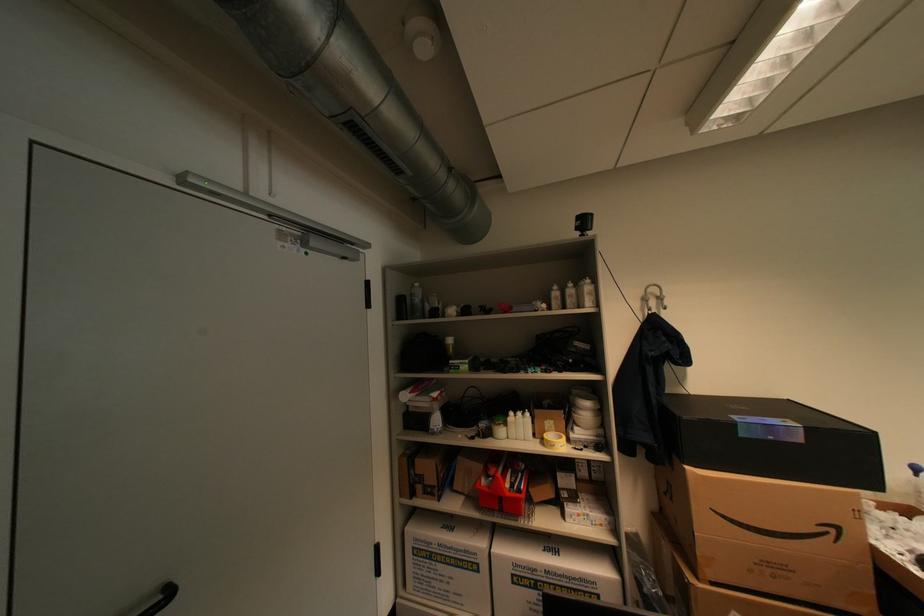
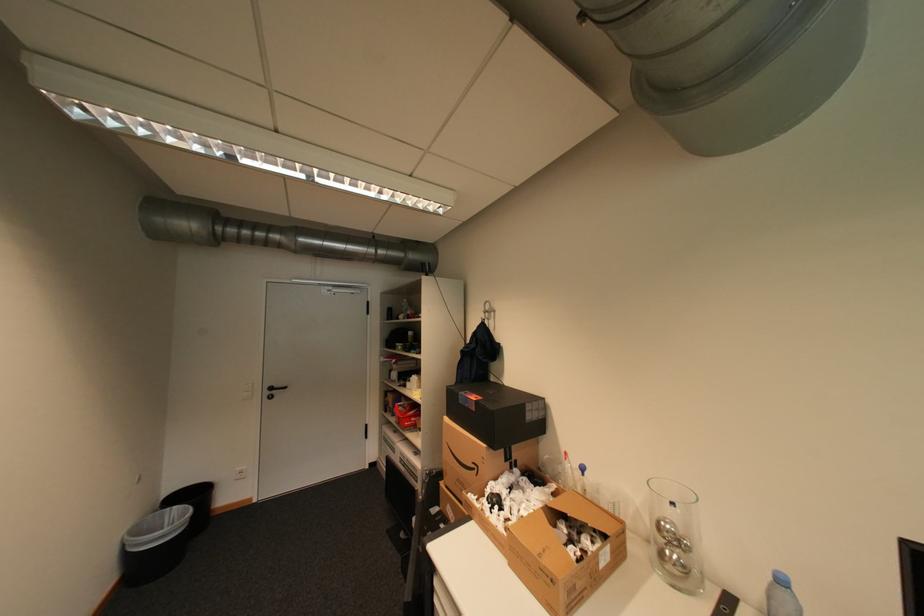
Locate, in the second image, the point that corresponds to [780,438] in the first image.

(476, 406)